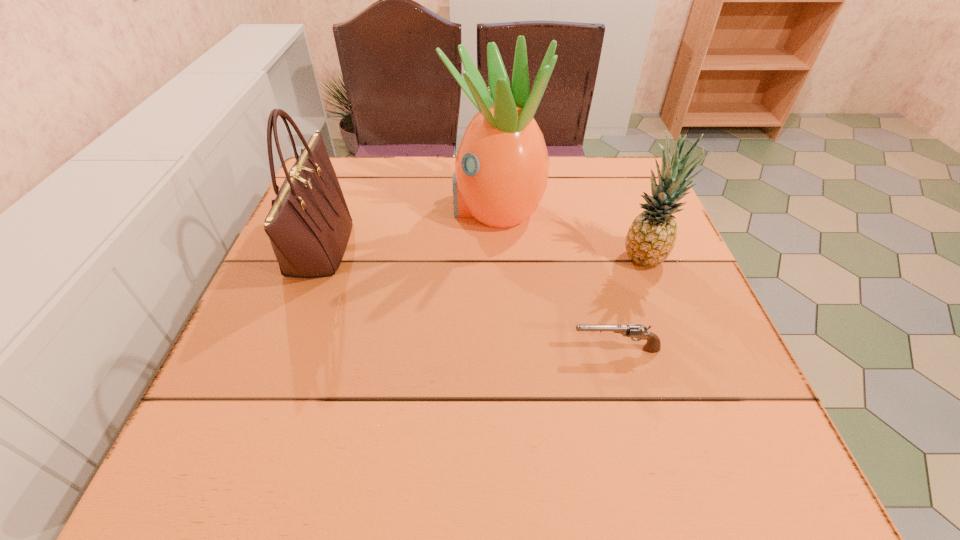
Locate an element on the screen. Image resolution: width=960 pixels, height=540 pixels. vacant space situated 0.200m on the back of the right pineapple is located at coordinates (619, 191).

You are a GUI agent. You are given a task and a screenshot of the screen. Output one action in this format:
    pyautogui.click(x=<x>, y=<y>)
    Task: Click on the vacant space located aiming along the barrel of the shortest object
    
    Given the screenshot: What is the action you would take?
    pyautogui.click(x=511, y=349)

Locate an element on the screen. Image resolution: width=960 pixels, height=540 pixels. free spot located aiming along the barrel of the shortest object is located at coordinates (461, 349).

The height and width of the screenshot is (540, 960). In order to click on free spot located aiming along the barrel of the shortest object in this screenshot , I will do `click(483, 349)`.

This screenshot has width=960, height=540. Find the location of `pineapple that is at the far edge`. pineapple that is at the far edge is located at coordinates (501, 169).

Where is `handbag present at the far edge`? The height and width of the screenshot is (540, 960). handbag present at the far edge is located at coordinates (309, 224).

Identify the location of object that is at the left edge. Image resolution: width=960 pixels, height=540 pixels. (309, 224).

The image size is (960, 540). In order to click on pineapple at the right edge in this screenshot , I will do `click(651, 237)`.

This screenshot has height=540, width=960. What are the coordinates of `gun that is at the right edge` in the screenshot? It's located at (653, 344).

Find the location of a particular element. The height and width of the screenshot is (540, 960). object that is at the far left corner is located at coordinates (309, 224).